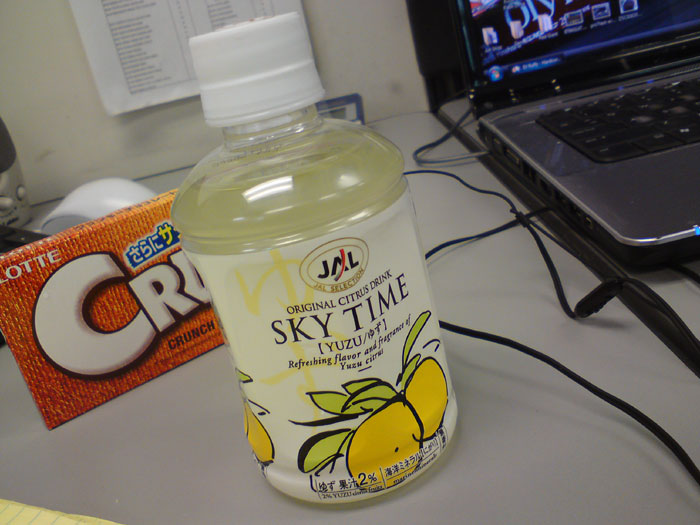
You are a GUI agent. You are given a task and a screenshot of the screen. Output one action in this format:
    pyautogui.click(x=<x>, y=<y>)
    Task: Click on the wall
    This screenshot has width=700, height=525.
    Given the screenshot: What is the action you would take?
    pyautogui.click(x=35, y=39)